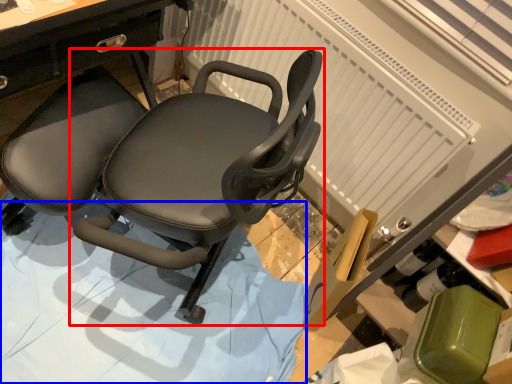
Question: Among these objects, which one is farthest to the camera, chair (highlighted by a red box) or surface (highlighted by a blue box)?

Choices:
 (A) chair
 (B) surface

Answer: (B)